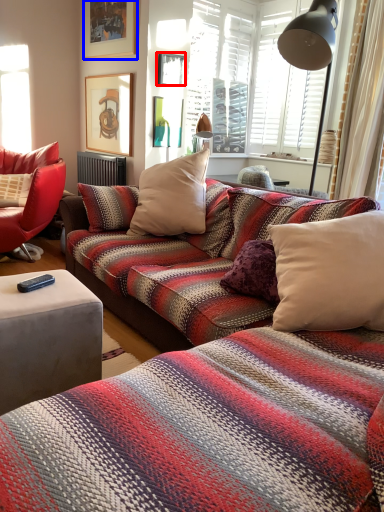
Question: Which point is further to the camera, picture frame (highlighted by a red box) or picture frame (highlighted by a blue box)?

Choices:
 (A) picture frame
 (B) picture frame

Answer: (A)